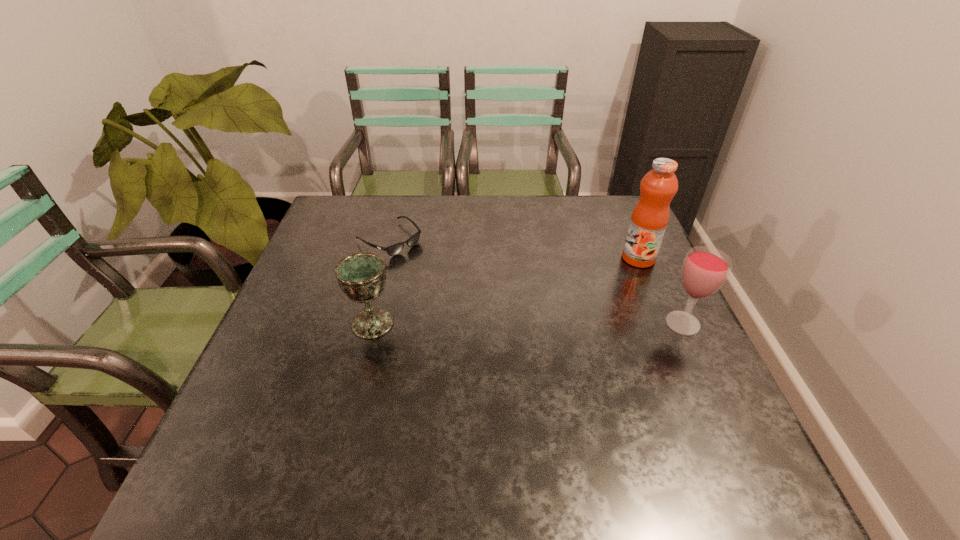
Where is `vacant area located on the front label of the tallest object`? Image resolution: width=960 pixels, height=540 pixels. vacant area located on the front label of the tallest object is located at coordinates (557, 301).

Where is `free space located on the front label of the tallest object`? free space located on the front label of the tallest object is located at coordinates (596, 280).

Identify the location of object that is at the far edge. Image resolution: width=960 pixels, height=540 pixels. (395, 249).

You are a GUI agent. You are given a task and a screenshot of the screen. Output one action in this format:
    pyautogui.click(x=<x>, y=<y>)
    Task: Click on the object that is at the left edge
    
    Given the screenshot: What is the action you would take?
    pyautogui.click(x=395, y=249)

Image resolution: width=960 pixels, height=540 pixels. In order to click on wineglass located at the right edge in this screenshot , I will do `click(705, 269)`.

Where is `fruit juice located at the right edge`? The height and width of the screenshot is (540, 960). fruit juice located at the right edge is located at coordinates (649, 219).

Identify the location of object present at the far left corner. This screenshot has height=540, width=960. (395, 249).

In the image, there is a desktop. In order to click on vacant space at the far edge in this screenshot , I will do `click(542, 214)`.

Locate an element on the screen. This screenshot has width=960, height=540. free region at the near edge of the desktop is located at coordinates (499, 431).

Find the location of a particular element. The height and width of the screenshot is (540, 960). vacant space at the left edge of the desktop is located at coordinates (274, 373).